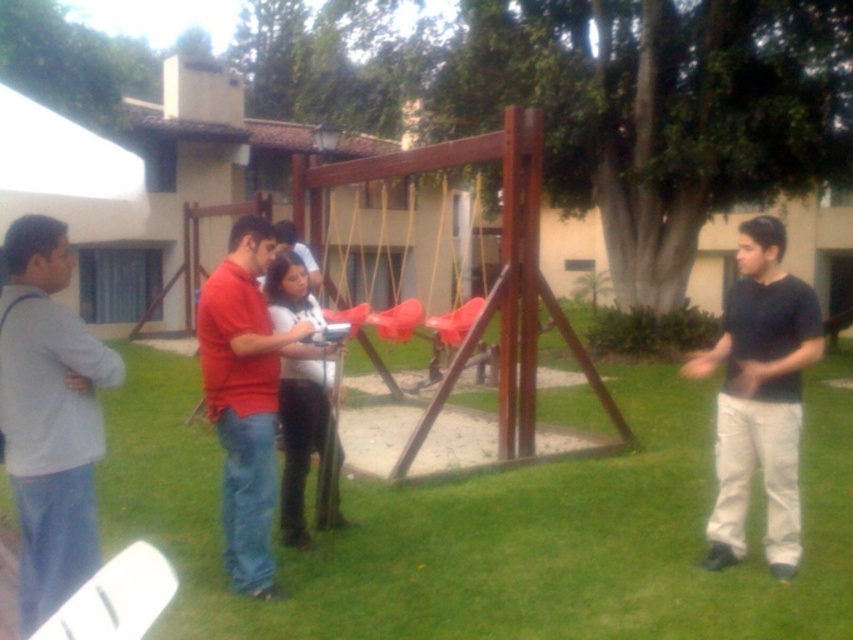
Does red matte shirt at center appear on the right side of white matte shirt at center?

No, red matte shirt at center is not to the right of white matte shirt at center.

Is red matte shirt at center to the left of white matte shirt at center from the viewer's perspective?

Indeed, red matte shirt at center is positioned on the left side of white matte shirt at center.

Where is `red matte shirt at center`? red matte shirt at center is located at coordinates pyautogui.click(x=247, y=397).

Which is in front, point (778, 362) or point (299, 440)?

Point (778, 362) is in front.

Does black cotton shirt at right appear under white matte shirt at center?

No, black cotton shirt at right is not below white matte shirt at center.

I want to click on black cotton shirt at right, so click(x=759, y=397).

Between green grass at center and white matte shirt at center, which one appears on the left side from the viewer's perspective?

white matte shirt at center

Describe the element at coordinates (496, 529) in the screenshot. This screenshot has width=853, height=640. I see `green grass at center` at that location.

Does point (318, 611) come farther from viewer compared to point (332, 378)?

That is False.

Find the location of a particular element. Image resolution: width=853 pixels, height=640 pixels. green grass at center is located at coordinates (496, 529).